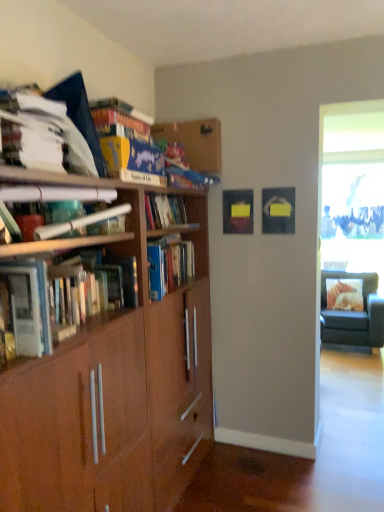
Describe the element at coordinates (105, 354) in the screenshot. This screenshot has width=384, height=512. I see `brown wood bookcase at left` at that location.

Find the location of a particular element. This screenshot has width=384, height=512. white paper at upper left, which ranks as the third book in bottom-to-top order is located at coordinates (42, 135).

How much space does matte blue book at upper center, placed as the first book when sorted from top to bottom, occupy vertically?

The height of matte blue book at upper center, placed as the first book when sorted from top to bottom, is 11.91 inches.

At what (x,y) coordinates should I click in order to perform the action: click on wooden bookshelf at upper center. Please return your answer as a coordinate pair (x, y). This screenshot has width=384, height=512. Looking at the image, I should click on (195, 142).

The width and height of the screenshot is (384, 512). Identify the location of matte brown paper at upper left, the second book from the bottom. (55, 194).

Is wooden bookshelf at upper center completely or partially inside black fabric chair at right?

No, black fabric chair at right does not contain wooden bookshelf at upper center.

From the image's perspective, is black fabric chair at right above wooden bookshelf at upper center?

No, from the image's perspective, black fabric chair at right is not over wooden bookshelf at upper center.

Which point is more distant from viewer, (372,289) or (209,122)?

The point (372,289) is farther.

Is black fabric chair at right at the right side of matte brown paper at upper left, the second book from the bottom?

Correct, you'll find black fabric chair at right to the right of matte brown paper at upper left, the second book from the bottom.

Is black fabric chair at right wider or thinner than matte brown paper at upper left, the 3th book in the top-to-bottom sequence?

Considering their sizes, black fabric chair at right looks broader than matte brown paper at upper left, the 3th book in the top-to-bottom sequence.

From the image's perspective, is black fabric chair at right located beneath matte brown paper at upper left, the 3th book in the top-to-bottom sequence?

Yes.

Does hardcover books at left, which appears as the 1th book when ordered from the bottom, have a greater width compared to brown wood bookcase at left?

Incorrect, the width of hardcover books at left, which appears as the 1th book when ordered from the bottom, does not surpass that of brown wood bookcase at left.

Are hardcover books at left, which ranks as the 4th book in top-to-bottom order, and brown wood bookcase at left beside each other?

hardcover books at left, which ranks as the 4th book in top-to-bottom order, is not next to brown wood bookcase at left, and they're not touching.

From a real-world perspective, does hardcover books at left, which appears as the 1th book when ordered from the bottom, stand above brown wood bookcase at left?

Indeed, from a real-world perspective, hardcover books at left, which appears as the 1th book when ordered from the bottom, stands above brown wood bookcase at left.

Considering the relative positions of hardcover books at left, which ranks as the 4th book in top-to-bottom order, and brown wood bookcase at left in the image provided, is hardcover books at left, which ranks as the 4th book in top-to-bottom order, to the right of brown wood bookcase at left from the viewer's perspective?

No, hardcover books at left, which ranks as the 4th book in top-to-bottom order, is not to the right of brown wood bookcase at left.

Is point (68, 331) positioned in front of point (212, 148)?

Yes.

From their relative heights in the image, would you say hardcover books at left, which appears as the 1th book when ordered from the bottom, is taller or shorter than wooden bookshelf at upper center?

Clearly, hardcover books at left, which appears as the 1th book when ordered from the bottom, is shorter compared to wooden bookshelf at upper center.

Can you tell me how much hardcover books at left, which ranks as the 4th book in top-to-bottom order, and wooden bookshelf at upper center differ in facing direction?

1.15 degrees.

From a real-world perspective, is hardcover books at left, which appears as the 1th book when ordered from the bottom, beneath wooden bookshelf at upper center?

Yes, from a real-world perspective, hardcover books at left, which appears as the 1th book when ordered from the bottom, is below wooden bookshelf at upper center.

Do you think matte blue book at upper center, which ranks as the fourth book in bottom-to-top order, is within wooden bookshelf at upper center, or outside of it?

matte blue book at upper center, which ranks as the fourth book in bottom-to-top order, is located beyond the bounds of wooden bookshelf at upper center.

Considering the positions of points (210, 148) and (178, 131), is point (210, 148) closer to camera compared to point (178, 131)?

Yes, it is in front of point (178, 131).

Does matte blue book at upper center, which ranks as the fourth book in bottom-to-top order, have a larger size compared to wooden bookshelf at upper center?

Yes, matte blue book at upper center, which ranks as the fourth book in bottom-to-top order, is bigger than wooden bookshelf at upper center.

Is matte blue book at upper center, placed as the first book when sorted from top to bottom, directly adjacent to wooden bookshelf at upper center?

matte blue book at upper center, placed as the first book when sorted from top to bottom, and wooden bookshelf at upper center are not in contact.

Based on their positions, is white paper at upper left, which ranks as the third book in bottom-to-top order, located to the left or right of matte brown paper at upper left, the second book from the bottom?

In the image, white paper at upper left, which ranks as the third book in bottom-to-top order, appears on the left side of matte brown paper at upper left, the second book from the bottom.

From the image's perspective, does white paper at upper left, which ranks as the third book in bottom-to-top order, appear higher than matte brown paper at upper left, the second book from the bottom?

Indeed, from the image's perspective, white paper at upper left, which ranks as the third book in bottom-to-top order, is shown above matte brown paper at upper left, the second book from the bottom.

The height and width of the screenshot is (512, 384). I want to click on chair to the right of hardcover books at left, which ranks as the 4th book in top-to-bottom order, so point(353,314).

From a real-world perspective, does hardcover books at left, which ranks as the 4th book in top-to-bottom order, stand above black fabric chair at right?

Indeed, from a real-world perspective, hardcover books at left, which ranks as the 4th book in top-to-bottom order, stands above black fabric chair at right.

The width and height of the screenshot is (384, 512). Find the location of `shelf to the left of black fabric chair at right`. shelf to the left of black fabric chair at right is located at coordinates (195, 142).

Image resolution: width=384 pixels, height=512 pixels. What are the coordinates of `chair on the right of matte brown paper at upper left, the 3th book in the top-to-bottom sequence` in the screenshot? It's located at (353, 314).

From the image, which object appears to be farther from brown wood bookcase at left, matte blue book at upper center, which ranks as the fourth book in bottom-to-top order, or white paper at upper left, which is counted as the 2th book, starting from the top?

matte blue book at upper center, which ranks as the fourth book in bottom-to-top order, is positioned further to the anchor brown wood bookcase at left.

Which object lies further to the anchor point hardcover books at left, which ranks as the 4th book in top-to-bottom order, matte brown paper at upper left, the second book from the bottom, or white paper at upper left, which is counted as the 2th book, starting from the top?

white paper at upper left, which is counted as the 2th book, starting from the top, lies further to hardcover books at left, which ranks as the 4th book in top-to-bottom order, than the other object.

Looking at this image, considering their positions, is white paper at upper left, which ranks as the third book in bottom-to-top order, positioned further to hardcover books at left, which appears as the 1th book when ordered from the bottom, than black fabric chair at right?

Based on the image, black fabric chair at right appears to be further to hardcover books at left, which appears as the 1th book when ordered from the bottom.

Considering their positions, is black fabric chair at right positioned further to white paper at upper left, which is counted as the 2th book, starting from the top, than brown wood bookcase at left?

Based on the image, black fabric chair at right appears to be further to white paper at upper left, which is counted as the 2th book, starting from the top.

From the image, which object appears to be nearer to black fabric chair at right, brown wood bookcase at left or matte brown paper at upper left, the second book from the bottom?

Among the two, brown wood bookcase at left is located nearer to black fabric chair at right.

Based on their spatial positions, is white paper at upper left, which ranks as the third book in bottom-to-top order, or wooden bookshelf at upper center closer to hardcover books at left, which appears as the 1th book when ordered from the bottom?

white paper at upper left, which ranks as the third book in bottom-to-top order, is positioned closer to the anchor hardcover books at left, which appears as the 1th book when ordered from the bottom.

From the image, which object appears to be farther from black fabric chair at right, wooden bookshelf at upper center or matte blue book at upper center, which ranks as the fourth book in bottom-to-top order?

matte blue book at upper center, which ranks as the fourth book in bottom-to-top order, is positioned further to the anchor black fabric chair at right.

When comparing their distances from black fabric chair at right, does white paper at upper left, which ranks as the third book in bottom-to-top order, or matte blue book at upper center, placed as the first book when sorted from top to bottom, seem further?

The object further to black fabric chair at right is white paper at upper left, which ranks as the third book in bottom-to-top order.

Where is `book that lies between white paper at upper left, which ranks as the third book in bottom-to-top order, and hardcover books at left, which appears as the 1th book when ordered from the bottom, from top to bottom`? The height and width of the screenshot is (512, 384). book that lies between white paper at upper left, which ranks as the third book in bottom-to-top order, and hardcover books at left, which appears as the 1th book when ordered from the bottom, from top to bottom is located at coordinates (55, 194).

This screenshot has height=512, width=384. In order to click on shelf positioned between hardcover books at left, which ranks as the 4th book in top-to-bottom order, and black fabric chair at right from near to far in this screenshot , I will do `click(195, 142)`.

This screenshot has width=384, height=512. Find the location of `shelf located between white paper at upper left, which is counted as the 2th book, starting from the top, and black fabric chair at right in the depth direction`. shelf located between white paper at upper left, which is counted as the 2th book, starting from the top, and black fabric chair at right in the depth direction is located at coordinates (195, 142).

At what (x,y) coordinates should I click in order to perform the action: click on book located between matte brown paper at upper left, the second book from the bottom, and matte blue book at upper center, placed as the first book when sorted from top to bottom, in the depth direction. Please return your answer as a coordinate pair (x, y). Looking at the image, I should click on (42, 135).